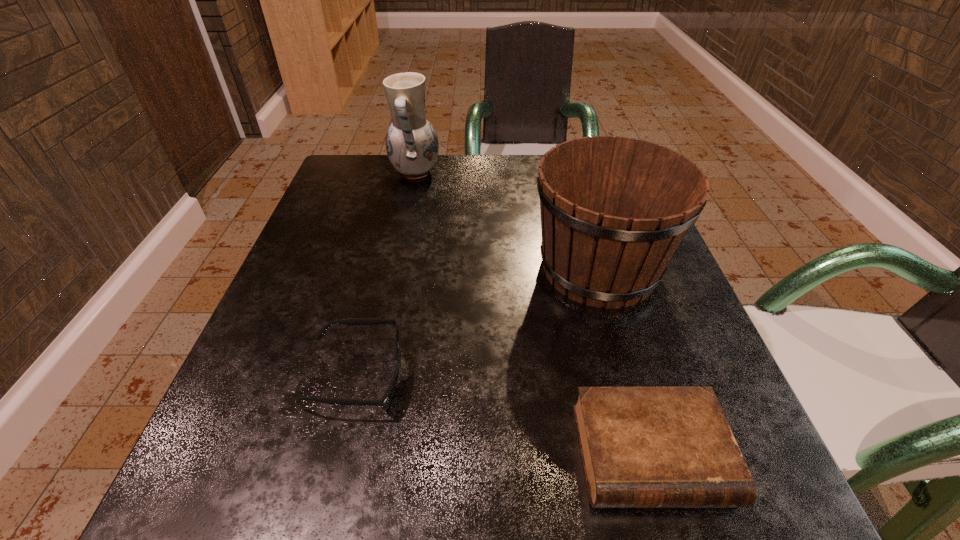
The image size is (960, 540). I want to click on object that is the closest to the wine bucket, so pos(642,447).

Point out which object is positioned as the nearest to the sunglasses. Please provide its 2D coordinates. Your answer should be formatted as a tuple, i.e. [(x, y)], where the tuple contains the x and y coordinates of a point satisfying the conditions above.

[(614, 210)]

Where is `free location that satisfies the following two spatial constraints: 1. on the back side of the second farthest object; 2. on either side of the pottery`? Image resolution: width=960 pixels, height=540 pixels. free location that satisfies the following two spatial constraints: 1. on the back side of the second farthest object; 2. on either side of the pottery is located at coordinates (571, 173).